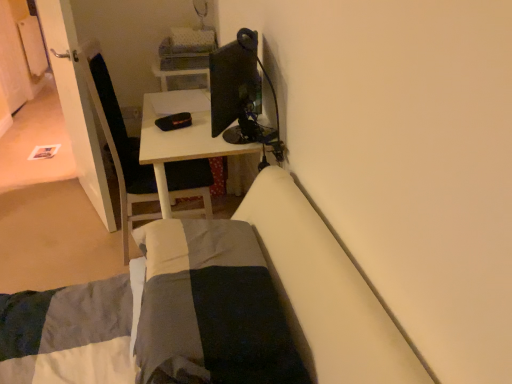
What do you see at coordinates (186, 147) in the screenshot? I see `white glossy desk at center` at bounding box center [186, 147].

At what (x,y) coordinates should I click in order to perform the action: click on matte black monitor at upper center. Please return your answer as a coordinate pair (x, y). The height and width of the screenshot is (384, 512). Looking at the image, I should click on (236, 88).

In the scene shown: Which object is more forward, dark gray cotton blanket at lower center or white glossy desk at center?

dark gray cotton blanket at lower center is closer to the camera.

From the picture: Between dark gray cotton blanket at lower center and white glossy desk at center, which one has larger size?

Bigger between the two is white glossy desk at center.

From a real-world perspective, is dark gray cotton blanket at lower center positioned above or below white glossy desk at center?

From a real-world perspective, dark gray cotton blanket at lower center is physically above white glossy desk at center.

Are dark gray cotton blanket at lower center and white glossy desk at center beside each other?

dark gray cotton blanket at lower center is not next to white glossy desk at center, and they're not touching.

Who is taller, white glossy door at left or dark gray cotton blanket at lower center?

With more height is white glossy door at left.

How different are the orientations of white glossy door at left and dark gray cotton blanket at lower center in degrees?

The facing directions of white glossy door at left and dark gray cotton blanket at lower center are 19.2 degrees apart.

Is point (50, 57) positioned before point (227, 367)?

No, it is behind (227, 367).

Does white glossy door at left turn towards dark gray cotton blanket at lower center?

No.

At what (x,y) coordinates should I click in order to perform the action: click on desk below the white glossy door at left (from the image's perspective). Please return your answer as a coordinate pair (x, y). Image resolution: width=512 pixels, height=384 pixels. Looking at the image, I should click on (186, 147).

Is white glossy door at left completely or partially outside of white glossy desk at center?

Yes, white glossy door at left is located beyond the bounds of white glossy desk at center.

Between white glossy door at left and white glossy desk at center, which one is positioned in front?

white glossy desk at center is closer to the camera.

Is point (84, 176) closer to viewer compared to point (211, 149)?

That is False.

This screenshot has height=384, width=512. In order to click on door lying on the left of matte black monitor at upper center in this screenshot , I will do `click(76, 105)`.

Looking at this image, is matte black monitor at upper center not close to white glossy door at left?

No.

From the image's perspective, is matte black monitor at upper center above or below white glossy door at left?

From the image's perspective, matte black monitor at upper center appears below white glossy door at left.

How far apart are matte black monitor at upper center and white glossy desk at center?

matte black monitor at upper center and white glossy desk at center are 8.82 inches apart.

Which object is wider, matte black monitor at upper center or white glossy desk at center?

With larger width is white glossy desk at center.

Is matte black monitor at upper center next to white glossy desk at center and touching it?

No, matte black monitor at upper center is not making contact with white glossy desk at center.

Which is further, (233, 59) or (230, 161)?

Positioned behind is point (230, 161).

Between dark gray cotton blanket at lower center and white glossy door at left, which one has smaller width?

Thinner between the two is white glossy door at left.

Relative to white glossy door at left, is dark gray cotton blanket at lower center in front or behind?

Clearly, dark gray cotton blanket at lower center is in front of white glossy door at left.

Who is bigger, dark gray cotton blanket at lower center or white glossy door at left?

white glossy door at left is bigger.

Could you tell me if dark gray cotton blanket at lower center is facing white glossy door at left?

No, dark gray cotton blanket at lower center is not aimed at white glossy door at left.

From the image's perspective, is matte black monitor at upper center over dark gray cotton blanket at lower center?

Yes, from the image's perspective, matte black monitor at upper center is above dark gray cotton blanket at lower center.

Is matte black monitor at upper center facing towards dark gray cotton blanket at lower center?

No, matte black monitor at upper center is not aimed at dark gray cotton blanket at lower center.

Considering the sizes of matte black monitor at upper center and dark gray cotton blanket at lower center in the image, is matte black monitor at upper center wider or thinner than dark gray cotton blanket at lower center?

Clearly, matte black monitor at upper center has less width compared to dark gray cotton blanket at lower center.

From a real-world perspective, does matte black monitor at upper center stand above dark gray cotton blanket at lower center?

Yes, from a real-world perspective, matte black monitor at upper center is above dark gray cotton blanket at lower center.

This screenshot has height=384, width=512. Find the location of `desk directly beneath the dark gray cotton blanket at lower center (from a real-world perspective)`. desk directly beneath the dark gray cotton blanket at lower center (from a real-world perspective) is located at coordinates (186, 147).

Where is `door located behind the dark gray cotton blanket at lower center`? door located behind the dark gray cotton blanket at lower center is located at coordinates (76, 105).

Which object lies further to the anchor point white glossy desk at center, matte black monitor at upper center or white glossy door at left?

Based on the image, white glossy door at left appears to be further to white glossy desk at center.

When comparing their distances from matte black monitor at upper center, does white glossy desk at center or dark gray cotton blanket at lower center seem closer?

Based on the image, white glossy desk at center appears to be nearer to matte black monitor at upper center.

Looking at the image, which one is located further to white glossy door at left, white glossy desk at center or dark gray cotton blanket at lower center?

The object further to white glossy door at left is dark gray cotton blanket at lower center.

Based on their spatial positions, is matte black monitor at upper center or dark gray cotton blanket at lower center closer to white glossy door at left?

matte black monitor at upper center is closer to white glossy door at left.

Which object lies further to the anchor point dark gray cotton blanket at lower center, white glossy desk at center or matte black monitor at upper center?

matte black monitor at upper center lies further to dark gray cotton blanket at lower center than the other object.

From the image, which object appears to be farther from dark gray cotton blanket at lower center, matte black monitor at upper center or white glossy desk at center?

Based on the image, matte black monitor at upper center appears to be further to dark gray cotton blanket at lower center.

Looking at the image, which one is located closer to matte black monitor at upper center, white glossy door at left or white glossy desk at center?

white glossy desk at center is closer to matte black monitor at upper center.

Looking at the image, which one is located further to white glossy door at left, dark gray cotton blanket at lower center or matte black monitor at upper center?

dark gray cotton blanket at lower center is further to white glossy door at left.

You are a GUI agent. You are given a task and a screenshot of the screen. Output one action in this format:
    pyautogui.click(x=<x>, y=<y>)
    Task: Click on the desk between dark gray cotton blanket at lower center and white glossy door at left along the z-axis
    Image resolution: width=512 pixels, height=384 pixels.
    Given the screenshot: What is the action you would take?
    pyautogui.click(x=186, y=147)

Image resolution: width=512 pixels, height=384 pixels. What are the coordinates of `television between dark gray cotton blanket at lower center and white glossy desk at center in the front-back direction` in the screenshot? It's located at (236, 88).

Identify the location of blanket between white glossy door at left and matte black monitor at upper center in the horizontal direction. The height and width of the screenshot is (384, 512). (211, 308).

Where is `desk between white glossy door at left and matte black monitor at upper center`? Image resolution: width=512 pixels, height=384 pixels. desk between white glossy door at left and matte black monitor at upper center is located at coordinates (186, 147).